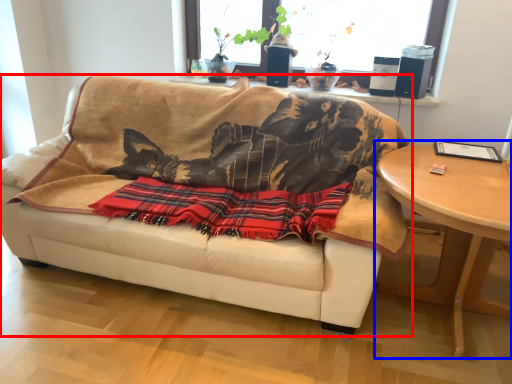
Question: Which of the following is the closest to the observer, studio couch (highlighted by a red box) or table (highlighted by a blue box)?

Choices:
 (A) studio couch
 (B) table

Answer: (B)